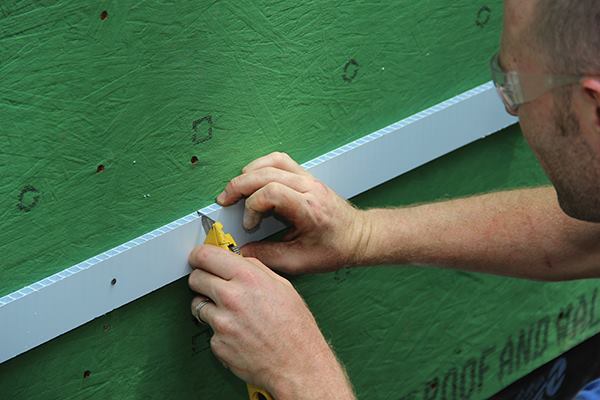
The image size is (600, 400). Find the location of `screw holes`. screw holes is located at coordinates (87, 371), (103, 16), (98, 169), (196, 160).